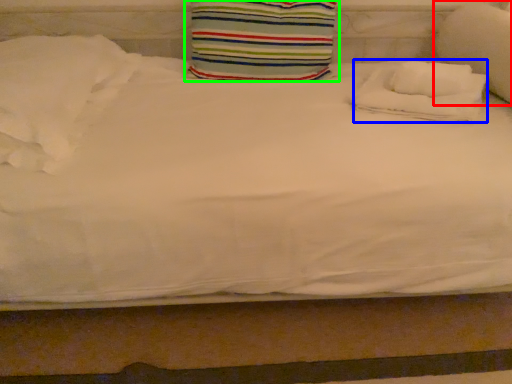
Question: Which object is the closest to the pillow (highlighted by a red box)? Choose among these: pillow (highlighted by a blue box) or pillow (highlighted by a green box).

Choices:
 (A) pillow
 (B) pillow

Answer: (A)